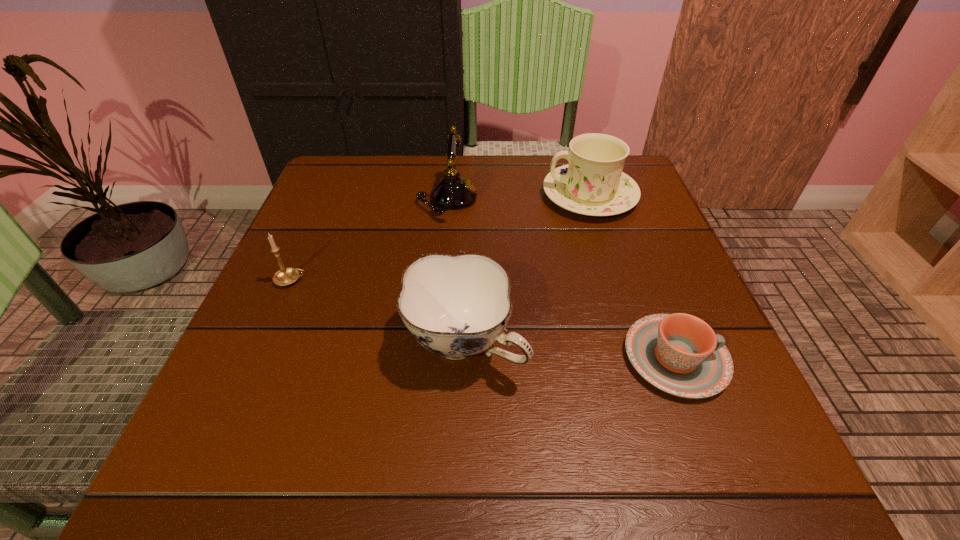
Locate an element on the screen. The image size is (960, 540). telephone is located at coordinates pos(453,192).

Locate an element on the screen. the farthest chinaware is located at coordinates (593, 184).

Identify the location of the leftmost chinaware. (456, 307).

Locate an element on the screen. the third nearest object is located at coordinates (285, 276).

Where is `candle holder`? candle holder is located at coordinates (285, 276).

Identify the location of the shortest object. click(680, 354).

I want to click on free space located on the dial of the telephone, so click(x=640, y=199).

At what (x,y) coordinates should I click in order to perform the action: click on vacant region located 0.100m on the handle side of the farthest chinaware. Please return your answer as a coordinate pair (x, y). The height and width of the screenshot is (540, 960). Looking at the image, I should click on (500, 195).

Where is `free space located 0.210m on the handle side of the farthest chinaware`? This screenshot has width=960, height=540. free space located 0.210m on the handle side of the farthest chinaware is located at coordinates (453, 195).

Locate an element on the screen. The height and width of the screenshot is (540, 960). blank space located on the handle side of the farthest chinaware is located at coordinates (483, 195).